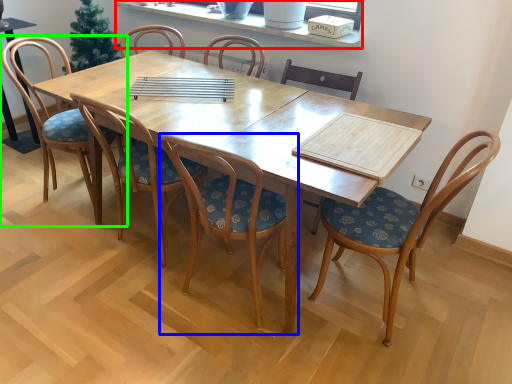
Question: Which object is the closest to the window sill (highlighted by a red box)? Choose among these: chair (highlighted by a blue box) or chair (highlighted by a green box).

Choices:
 (A) chair
 (B) chair

Answer: (B)